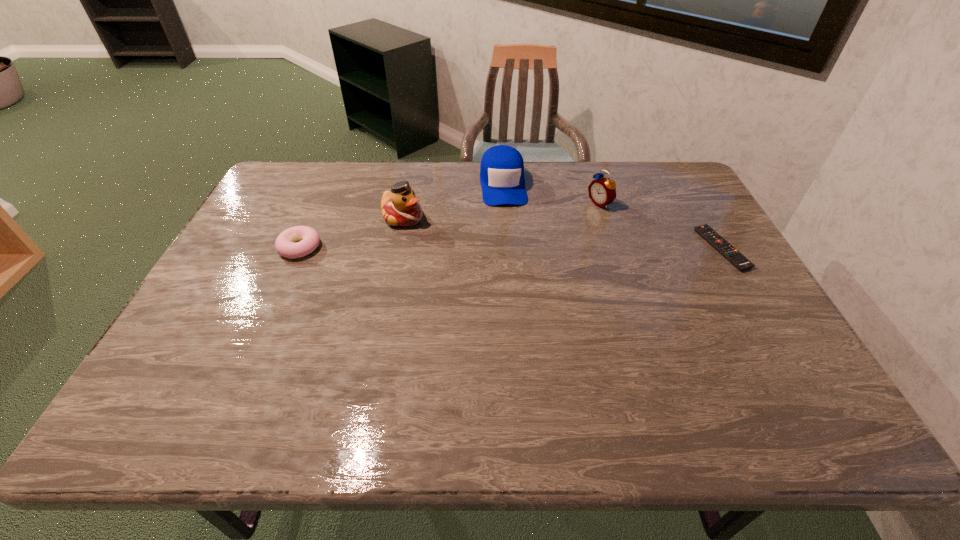
Image resolution: width=960 pixels, height=540 pixels. Identify the location of vacant point located between the baseball cap and the remote control. (612, 217).

The width and height of the screenshot is (960, 540). I want to click on vacant region between the third object from right to left and the fourth object from right to left, so point(453,201).

I want to click on vacant point located between the remote control and the alarm clock, so click(x=660, y=226).

Locate an element on the screen. free space between the duck and the shortest object is located at coordinates (563, 233).

Identify the location of unoccupied position between the alarm clock and the doughnut. The image size is (960, 540). (450, 225).

Where is `free spot between the third object from right to left and the alarm clock`? This screenshot has width=960, height=540. free spot between the third object from right to left and the alarm clock is located at coordinates (551, 194).

Locate an element on the screen. This screenshot has height=540, width=960. object that is the fourth closest to the third object from left to right is located at coordinates (738, 260).

Find the location of a particular element. object that can be found as the second closest to the baseball cap is located at coordinates (602, 191).

This screenshot has width=960, height=540. Identify the location of vacant area in the image that satisfies the following two spatial constraints: 1. on the front side of the shortest object; 2. on the right side of the fourth object from left to right. point(614,248).

Where is `free spot that satisfies the following two spatial constraints: 1. on the front side of the shortest object; 2. on the right side of the baseball cap`? free spot that satisfies the following two spatial constraints: 1. on the front side of the shortest object; 2. on the right side of the baseball cap is located at coordinates (507, 248).